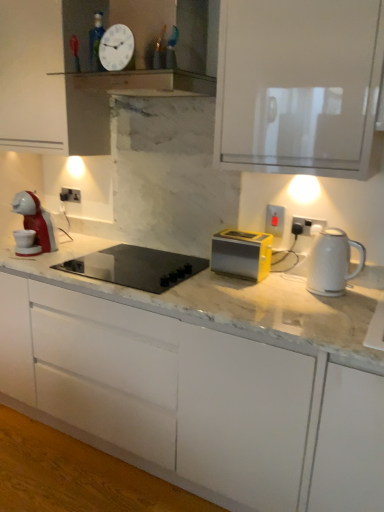
Describe the element at coordinates (332, 262) in the screenshot. I see `white glossy electric kettle at right` at that location.

Describe the element at coordinates (136, 267) in the screenshot. I see `black glass cooktop at center` at that location.

This screenshot has height=512, width=384. Identify the location of white plastic electric outlet at left, acting as the first electric outlet starting from the left. coord(70,195).

In the scene shown: Measure the distance between point (79, 192) and camera.

Point (79, 192) and camera are 2.46 meters apart.

Find the location of a particular element. white matte cabinet at center is located at coordinates (196, 400).

Identify the location of white glossy electric kettle at right. Image resolution: width=384 pixels, height=512 pixels. (332, 262).

Could you measure the distance between white plastic electric outlet at left, the third electric outlet positioned from the right, and white glossy clock at upper center?

A distance of 38.85 inches exists between white plastic electric outlet at left, the third electric outlet positioned from the right, and white glossy clock at upper center.

From the picture: From a real-world perspective, who is located lower, white plastic electric outlet at left, the third electric outlet positioned from the right, or white glossy clock at upper center?

From a 3D spatial view, white plastic electric outlet at left, the third electric outlet positioned from the right, is below.

Does white plastic electric outlet at left, the third electric outlet from the bottom, have a lesser width compared to white glossy clock at upper center?

No.

Is white plastic electric outlet at left, the third electric outlet from the bottom, facing away from white glossy clock at upper center?

No, white plastic electric outlet at left, the third electric outlet from the bottom, is not facing away from white glossy clock at upper center.

From the image's perspective, between matte plastic electric outlet at center-right, the second electric outlet from the top, and black glass cooktop at center, who is located below?

black glass cooktop at center.

Is matte plastic electric outlet at center-right, arranged as the second electric outlet when viewed from the right, not within black glass cooktop at center?

Indeed, matte plastic electric outlet at center-right, arranged as the second electric outlet when viewed from the right, is completely outside black glass cooktop at center.

Could you tell me if matte plastic electric outlet at center-right, the second electric outlet in the front-to-back sequence, is facing black glass cooktop at center?

No, matte plastic electric outlet at center-right, the second electric outlet in the front-to-back sequence, is not turned towards black glass cooktop at center.

Is matte plastic electric outlet at center-right, arranged as the second electric outlet when viewed from the right, positioned far away from black glass cooktop at center?

matte plastic electric outlet at center-right, arranged as the second electric outlet when viewed from the right, is actually quite close to black glass cooktop at center.

Considering the sizes of objects white glossy electric kettle at right and matte plastic electric outlet at center-right, the second electric outlet in the front-to-back sequence, in the image provided, who is wider, white glossy electric kettle at right or matte plastic electric outlet at center-right, the second electric outlet in the front-to-back sequence,?

Wider between the two is white glossy electric kettle at right.

From the image's perspective, is white glossy electric kettle at right positioned above or below matte plastic electric outlet at center-right, arranged as the second electric outlet when viewed from the right?

From the image's perspective, white glossy electric kettle at right appears below matte plastic electric outlet at center-right, arranged as the second electric outlet when viewed from the right.

Who is smaller, white glossy electric kettle at right or matte plastic electric outlet at center-right, the second electric outlet positioned from the back?

With smaller size is matte plastic electric outlet at center-right, the second electric outlet positioned from the back.

Which electric outlet is the 2nd one when counting from the left side of the white glossy electric kettle at right? Please provide its 2D coordinates.

[(275, 220)]

Which is more to the right, black glass cooktop at center or white matte cabinet at center?

Positioned to the right is white matte cabinet at center.

Is black glass cooktop at center aimed at white matte cabinet at center?

Yes, black glass cooktop at center is aimed at white matte cabinet at center.

Do you think black glass cooktop at center is within white matte cabinet at center, or outside of it?

black glass cooktop at center lies within the bounds of white matte cabinet at center.

From a real-world perspective, is black glass cooktop at center above or below white matte cabinet at center?

black glass cooktop at center is situated higher than white matte cabinet at center in the real world.

Based on the photo, which object is further away from the camera, white plastic electric outlet at left, the 3th electric outlet in the front-to-back sequence, or white matte cabinet at center?

white plastic electric outlet at left, the 3th electric outlet in the front-to-back sequence, is further away from the camera.

Which of these two, white plastic electric outlet at left, positioned as the 1th electric outlet in back-to-front order, or white matte cabinet at center, is bigger?

Bigger between the two is white matte cabinet at center.

From a real-world perspective, relative to white matte cabinet at center, is white plastic electric outlet at left, the third electric outlet from the bottom, vertically above or below?

white plastic electric outlet at left, the third electric outlet from the bottom, is above white matte cabinet at center.

Looking at this image, can you tell me how much white plastic electric outlet at left, the 3th electric outlet in the front-to-back sequence, and white matte cabinet at center differ in facing direction?

They differ by 13.8 degrees in their facing directions.

From a real-world perspective, is white glossy clock at upper center physically located above or below white plastic electric outlet at left, the third electric outlet positioned from the right?

In terms of real-world spatial position, white glossy clock at upper center is above white plastic electric outlet at left, the third electric outlet positioned from the right.

Between white glossy clock at upper center and white plastic electric outlet at left, acting as the first electric outlet starting from the left, which one is positioned in front?

white glossy clock at upper center.

Considering the positions of points (105, 67) and (77, 193), is point (105, 67) closer to camera compared to point (77, 193)?

That is True.

Consider the image. Are white glossy clock at upper center and white plastic electric outlet at left, positioned as the 1th electric outlet in back-to-front order, located far from each other?

No.

Considering the sizes of matte plastic electric outlet at center-right, arranged as the second electric outlet when viewed from the right, and white plastic electric outlet at center-right, which appears as the 3th electric outlet when viewed from the back, in the image, is matte plastic electric outlet at center-right, arranged as the second electric outlet when viewed from the right, bigger or smaller than white plastic electric outlet at center-right, which appears as the 3th electric outlet when viewed from the back,?

Clearly, matte plastic electric outlet at center-right, arranged as the second electric outlet when viewed from the right, is larger in size than white plastic electric outlet at center-right, which appears as the 3th electric outlet when viewed from the back.

Where is `electric outlet that is the 1st one when counting upward from the white plastic electric outlet at center-right, which ranks as the third electric outlet in left-to-right order (from the image's perspective)`? This screenshot has width=384, height=512. electric outlet that is the 1st one when counting upward from the white plastic electric outlet at center-right, which ranks as the third electric outlet in left-to-right order (from the image's perspective) is located at coordinates (275, 220).

From the image's perspective, is matte plastic electric outlet at center-right, which is the second electric outlet in left-to-right order, positioned above or below white plastic electric outlet at center-right, which ranks as the third electric outlet in left-to-right order?

Clearly, from the image's perspective, matte plastic electric outlet at center-right, which is the second electric outlet in left-to-right order, is above white plastic electric outlet at center-right, which ranks as the third electric outlet in left-to-right order.

Is matte plastic electric outlet at center-right, which is the second electric outlet in left-to-right order, positioned behind white plastic electric outlet at center-right, the 1th electric outlet in the right-to-left sequence?

Yes.

Where is `electric outlet on the left of white glossy clock at upper center`? This screenshot has height=512, width=384. electric outlet on the left of white glossy clock at upper center is located at coordinates (70, 195).

From the image's perspective, starting from the black glass cooktop at center, which electric outlet is the 2nd one above? Please provide its 2D coordinates.

[(275, 220)]

From the image, which object appears to be nearer to matte plastic electric outlet at center-right, arranged as the second electric outlet when viewed from the right, white plastic electric outlet at center-right, which appears as the 3th electric outlet when viewed from the back, or black glass cooktop at center?

white plastic electric outlet at center-right, which appears as the 3th electric outlet when viewed from the back, lies closer to matte plastic electric outlet at center-right, arranged as the second electric outlet when viewed from the right, than the other object.

From the image, which object appears to be nearer to white plastic electric outlet at left, the first electric outlet viewed from the top, white glossy clock at upper center or white plastic electric outlet at center-right, the 1th electric outlet viewed from the front?

white glossy clock at upper center.

From the image, which object appears to be farther from white plastic electric outlet at center-right, the 1th electric outlet viewed from the front, black glass cooktop at center or matte plastic electric outlet at center-right, arranged as the second electric outlet when viewed from the right?

black glass cooktop at center is further to white plastic electric outlet at center-right, the 1th electric outlet viewed from the front.

Looking at the image, which one is located closer to black glass cooktop at center, white plastic electric outlet at center-right, the third electric outlet in the top-to-bottom sequence, or white glossy clock at upper center?

white plastic electric outlet at center-right, the third electric outlet in the top-to-bottom sequence, lies closer to black glass cooktop at center than the other object.

Considering their positions, is matte plastic electric outlet at center-right, arranged as the second electric outlet when viewed from the right, positioned closer to white plastic electric outlet at center-right, the third electric outlet in the top-to-bottom sequence, than black glass cooktop at center?

matte plastic electric outlet at center-right, arranged as the second electric outlet when viewed from the right, lies closer to white plastic electric outlet at center-right, the third electric outlet in the top-to-bottom sequence, than the other object.

Based on their spatial positions, is white plastic electric outlet at center-right, the third electric outlet in the top-to-bottom sequence, or white glossy electric kettle at right further from white plastic electric outlet at left, the 3th electric outlet in the front-to-back sequence?

white glossy electric kettle at right is further to white plastic electric outlet at left, the 3th electric outlet in the front-to-back sequence.

From the image, which object appears to be farther from white plastic electric outlet at left, the third electric outlet from the bottom, black glass cooktop at center or white plastic electric outlet at center-right, the third electric outlet in the top-to-bottom sequence?

white plastic electric outlet at center-right, the third electric outlet in the top-to-bottom sequence, is further to white plastic electric outlet at left, the third electric outlet from the bottom.

Estimate the real-world distances between objects in this image. Which object is closer to white plastic electric outlet at center-right, which ranks as the third electric outlet in left-to-right order, white glossy electric kettle at right or black glass cooktop at center?

white glossy electric kettle at right is closer to white plastic electric outlet at center-right, which ranks as the third electric outlet in left-to-right order.

Locate an element on the screen. The image size is (384, 512). electric outlet between white glossy clock at upper center and white plastic electric outlet at center-right, which ranks as the third electric outlet in left-to-right order is located at coordinates tap(275, 220).

The height and width of the screenshot is (512, 384). I want to click on electric outlet between white glossy electric kettle at right and matte plastic electric outlet at center-right, the second electric outlet from the top, along the z-axis, so click(x=307, y=226).

The width and height of the screenshot is (384, 512). In order to click on home appliance located between white glossy clock at upper center and white plastic electric outlet at left, the third electric outlet positioned from the right, in the depth direction in this screenshot , I will do `click(136, 267)`.

The width and height of the screenshot is (384, 512). In order to click on home appliance between white matte cabinet at center and matte plastic electric outlet at center-right, arranged as the second electric outlet when viewed from the right, from front to back in this screenshot , I will do `click(136, 267)`.